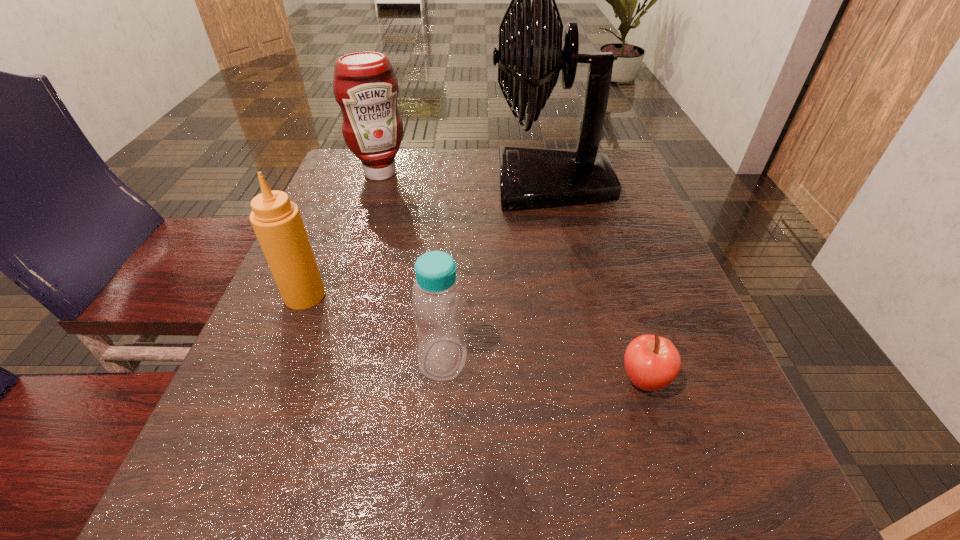
The image size is (960, 540). In order to click on free space at the near edge of the desktop in this screenshot , I will do `click(456, 516)`.

Where is `vacant area at the left edge of the desktop`? This screenshot has width=960, height=540. vacant area at the left edge of the desktop is located at coordinates (327, 293).

Locate an element on the screen. The height and width of the screenshot is (540, 960). vacant point at the right edge is located at coordinates (666, 288).

This screenshot has height=540, width=960. Find the location of `free spot at the near left corner of the desktop`. free spot at the near left corner of the desktop is located at coordinates (199, 531).

Where is `free spot between the shortest object and the farther condiment`? Image resolution: width=960 pixels, height=540 pixels. free spot between the shortest object and the farther condiment is located at coordinates click(513, 276).

The image size is (960, 540). I want to click on unoccupied position between the tallest object and the nearer condiment, so click(428, 240).

This screenshot has height=540, width=960. I want to click on free space that is in between the farther condiment and the nearer condiment, so click(x=343, y=234).

Identify the location of free space between the tallest object and the farther condiment. (466, 179).

Where is `vacant area that lies between the tallest object and the second shortest object`? The image size is (960, 540). vacant area that lies between the tallest object and the second shortest object is located at coordinates (497, 272).

You are a GUI agent. You are given a task and a screenshot of the screen. Output one action in this format:
    pyautogui.click(x=<x>, y=<y>)
    Task: Click on the vacant area that lies between the fan and the farther condiment
    
    Given the screenshot: What is the action you would take?
    pyautogui.click(x=466, y=179)